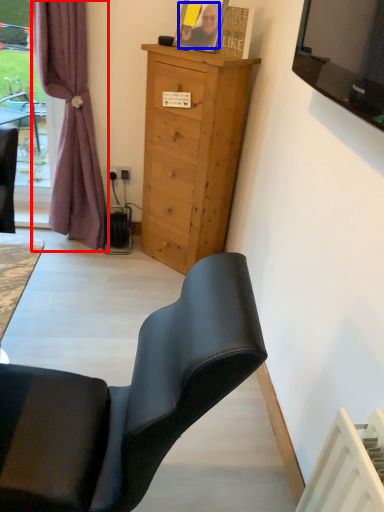
Question: Which object is further to the camera taking this photo, curtain (highlighted by a red box) or person (highlighted by a blue box)?

Choices:
 (A) curtain
 (B) person

Answer: (B)